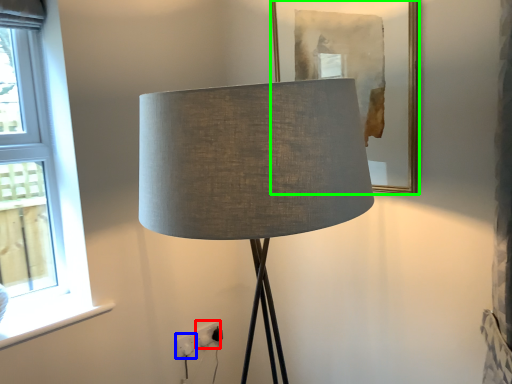
Question: Considering the real-world distances, which object is farthest from electric outlet (highlighted by a red box)? electric outlet (highlighted by a blue box) or picture frame (highlighted by a green box)?

Choices:
 (A) electric outlet
 (B) picture frame

Answer: (B)